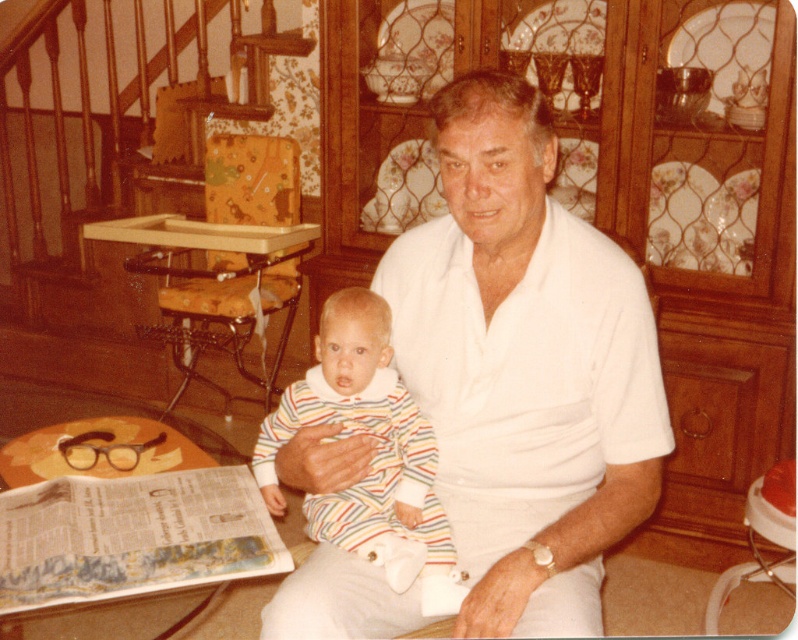
You are a photographer trying to capture a closeup of the white cotton shirt at center and the striped fabric onesie at center. Since you want to focus on both items equally, which one should you adjust the camera focus on first, considering their sizes?

The white cotton shirt at center has a greater height compared to striped fabric onesie at center, so you should focus on the white cotton shirt at center first as it is larger and will require more attention to ensure both are in focus.